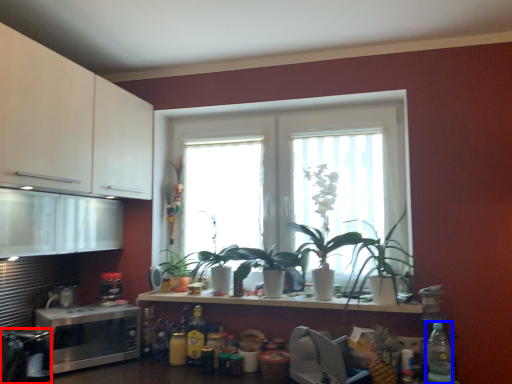
Question: Which point is further to the camera, appliance (highlighted by a red box) or bottle (highlighted by a blue box)?

Choices:
 (A) appliance
 (B) bottle

Answer: (A)